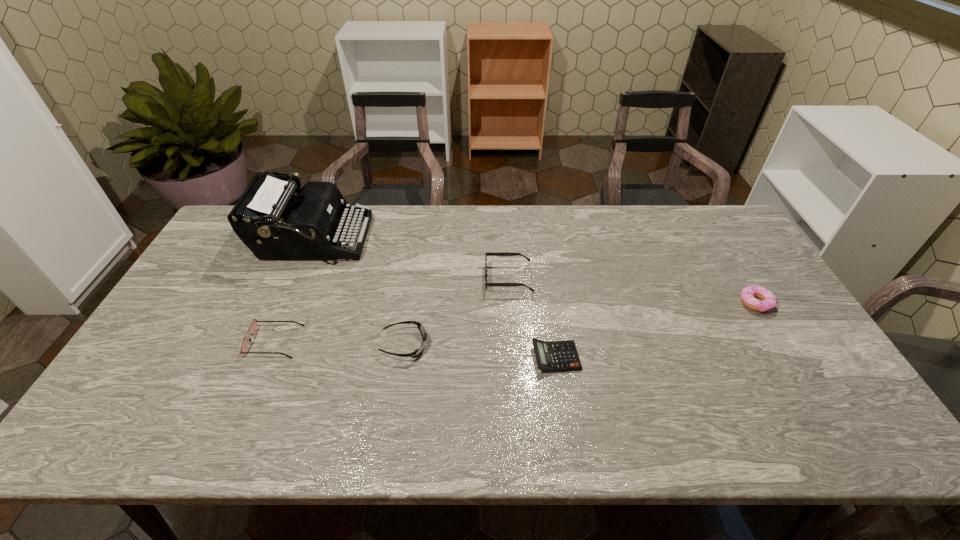
Image resolution: width=960 pixels, height=540 pixels. Find the location of `empty location between the rightmost object and the rightmost sunglasses`. empty location between the rightmost object and the rightmost sunglasses is located at coordinates (632, 291).

You are a GUI agent. You are given a task and a screenshot of the screen. Output one action in this format:
    pyautogui.click(x=<x>, y=<y>)
    Task: Click on the vacant space that's between the typewriter and the farthest sunglasses
    Image resolution: width=960 pixels, height=540 pixels.
    Given the screenshot: What is the action you would take?
    pyautogui.click(x=411, y=259)

The image size is (960, 540). I want to click on unoccupied position between the rightmost sunglasses and the leftmost sunglasses, so click(392, 310).

Image resolution: width=960 pixels, height=540 pixels. Identify the location of free space that is in between the doughnut and the leftmost sunglasses. (515, 322).

You are a GUI agent. You are given a task and a screenshot of the screen. Output one action in this format:
    pyautogui.click(x=<x>, y=<y>)
    Task: Click on the free space between the typewriter and the rightmost sunglasses
    
    Given the screenshot: What is the action you would take?
    pyautogui.click(x=411, y=259)

This screenshot has width=960, height=540. In order to click on object that is the third closest to the leftmost sunglasses in this screenshot , I will do `click(501, 253)`.

Where is `object that stands as the second closest to the calculator`? object that stands as the second closest to the calculator is located at coordinates (417, 352).

Identify which sunglasses is located as the second nearest to the doughnut. Please provide its 2D coordinates. Your answer should be formatted as a tuple, i.e. [(x, y)], where the tuple contains the x and y coordinates of a point satisfying the conditions above.

[(417, 352)]

I want to click on sunglasses that can be found as the second closest to the shortest object, so click(x=417, y=352).

I want to click on free spot that satisfies the following two spatial constraints: 1. on the lenses of the shortest object; 2. on the left side of the shortest sunglasses, so click(402, 357).